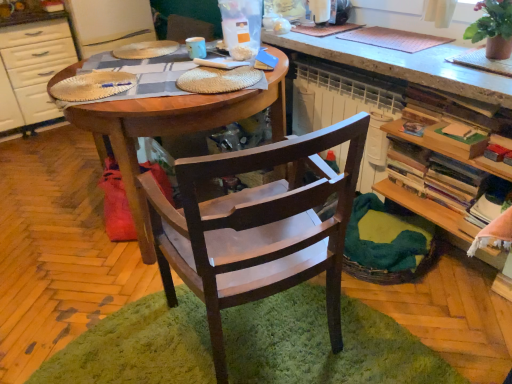
You are a GUI agent. You are given a task and a screenshot of the screen. Output one action in this format:
    pyautogui.click(x=<x>, y=<y>)
    Task: Click on the vacant region in front of woven brown basket at lower right
    
    Given the screenshot: What is the action you would take?
    pyautogui.click(x=434, y=310)